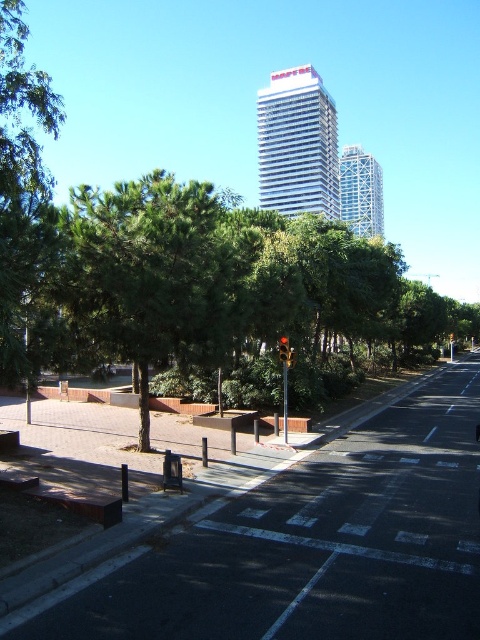
Is wooden bench at lower left in front of red glass traffic light at center?

Yes, wooden bench at lower left is closer to the viewer.

Based on the photo, how distant is wooden bench at lower left from red glass traffic light at center?

The distance of wooden bench at lower left from red glass traffic light at center is 5.52 meters.

Does point (176, 458) lie behind point (288, 355)?

No.

The image size is (480, 640). Identify the location of wooden bench at lower left. (171, 472).

Which is more to the left, green leafy tree at left or wooden bench at lower left?

green leafy tree at left is more to the left.

Does green leafy tree at left appear on the right side of wooden bench at lower left?

In fact, green leafy tree at left is to the left of wooden bench at lower left.

Between point (57, 106) and point (171, 468), which one is positioned behind?

The point (171, 468) is behind.

Where is `green leafy tree at left`? This screenshot has height=640, width=480. green leafy tree at left is located at coordinates (22, 184).

Between green leafy tree at left and red glass traffic light at center, which one appears on the right side from the viewer's perspective?

From the viewer's perspective, red glass traffic light at center appears more on the right side.

Who is lower down, green leafy tree at left or red glass traffic light at center?

red glass traffic light at center is below.

Who is more distant from viewer, (3, 285) or (288, 342)?

Point (288, 342)

Locate an element on the screen. green leafy tree at left is located at coordinates (22, 184).